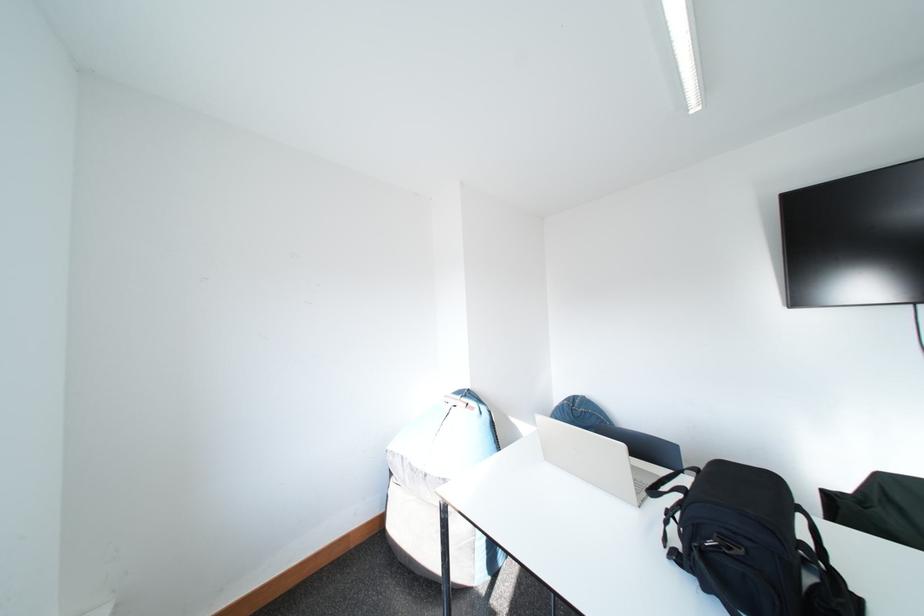
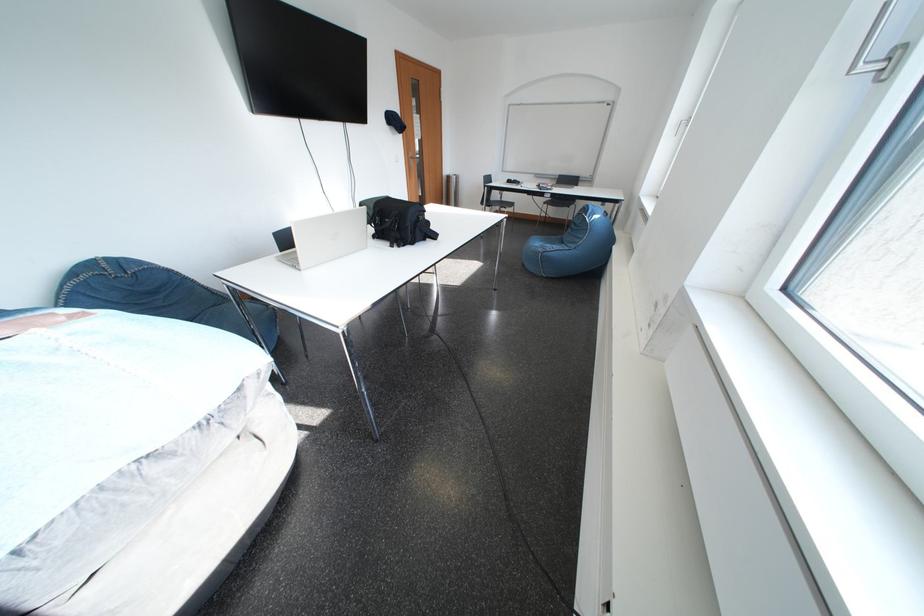
Question: I am providing you with two images of the same scene from different viewpoints. Which of the following objects are not visible in image2?

Choices:
 (A) silver trash can
 (B) black backpack
 (C) freezer handle
 (D) backpack zipper pull

Answer: (D)